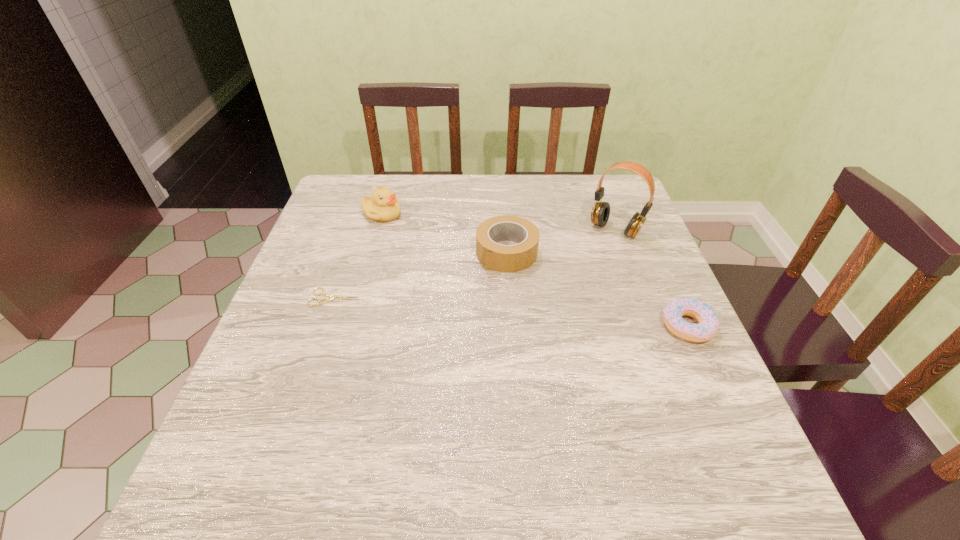
At what (x,y) coordinates should I click in order to perform the action: click on headset that is at the far edge. Please return your answer as a coordinate pair (x, y). Looking at the image, I should click on (600, 213).

At what (x,y) coordinates should I click in order to perform the action: click on shears that is at the left edge. Please return your answer as a coordinate pair (x, y). This screenshot has height=540, width=960. Looking at the image, I should click on (325, 300).

At what (x,y) coordinates should I click in order to perform the action: click on duckling situated at the left edge. Please return your answer as a coordinate pair (x, y). Image resolution: width=960 pixels, height=540 pixels. Looking at the image, I should click on (383, 206).

This screenshot has width=960, height=540. I want to click on doughnut present at the right edge, so click(708, 321).

You are a GUI agent. You are given a task and a screenshot of the screen. Output one action in this format:
    pyautogui.click(x=<x>, y=<y>)
    Task: Click on the headset present at the right edge
    The height and width of the screenshot is (540, 960).
    Given the screenshot: What is the action you would take?
    pyautogui.click(x=600, y=213)

The width and height of the screenshot is (960, 540). What are the coordinates of `object located at the far left corner` in the screenshot? It's located at (383, 206).

This screenshot has height=540, width=960. What are the coordinates of `object that is at the far right corner` in the screenshot? It's located at (600, 213).

In the image, there is a desktop. Where is `vacant space at the far edge`? vacant space at the far edge is located at coordinates (419, 207).

Locate an element on the screen. This screenshot has width=960, height=540. free space at the near edge is located at coordinates (538, 433).

Locate an element on the screen. This screenshot has height=540, width=960. free space at the left edge is located at coordinates (284, 293).